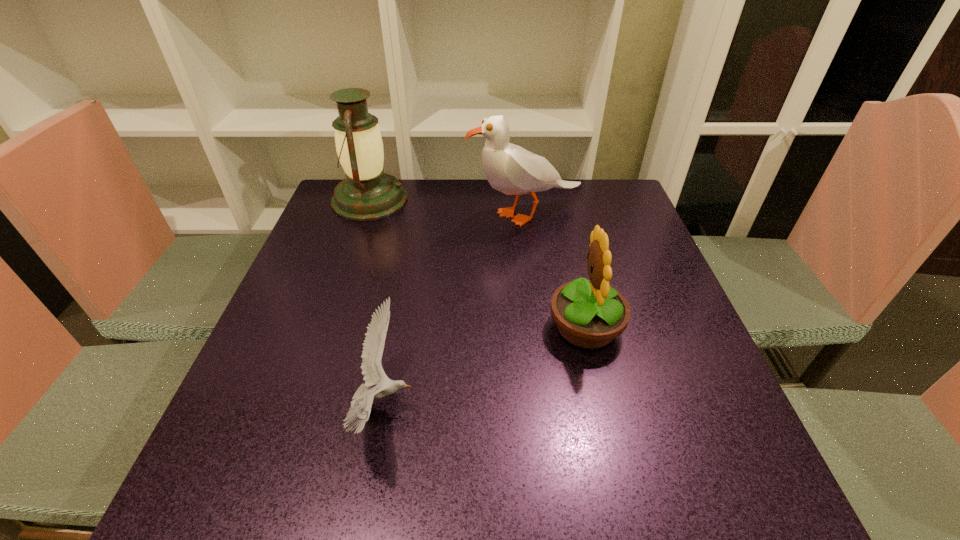
Locate an element on the screen. The width and height of the screenshot is (960, 540). free space located on the face of the sunflower is located at coordinates (524, 327).

Where is `vacant space located on the face of the sunflower`? vacant space located on the face of the sunflower is located at coordinates (421, 327).

Locate an element on the screen. This screenshot has height=540, width=960. vacant space located on the face of the sunflower is located at coordinates (494, 327).

You are a GUI agent. You are given a task and a screenshot of the screen. Output one action in this format:
    pyautogui.click(x=<x>, y=<y>)
    Task: Click on the vacant space located 0.160m at the tip of the beak of the shorter gull
    This screenshot has width=960, height=540.
    Given the screenshot: What is the action you would take?
    pyautogui.click(x=506, y=405)

This screenshot has height=540, width=960. Identify the location of lantern at the far edge. (367, 193).

This screenshot has width=960, height=540. In order to click on gull present at the far edge in this screenshot , I will do `click(509, 168)`.

In order to click on object that is at the near edge in this screenshot , I will do `click(373, 346)`.

Where is `object that is positioned at the left edge`? The width and height of the screenshot is (960, 540). object that is positioned at the left edge is located at coordinates (367, 193).

Find the location of a particular element. gull that is at the right edge is located at coordinates (509, 168).

The height and width of the screenshot is (540, 960). Identify the location of sunflower present at the right edge. (589, 314).